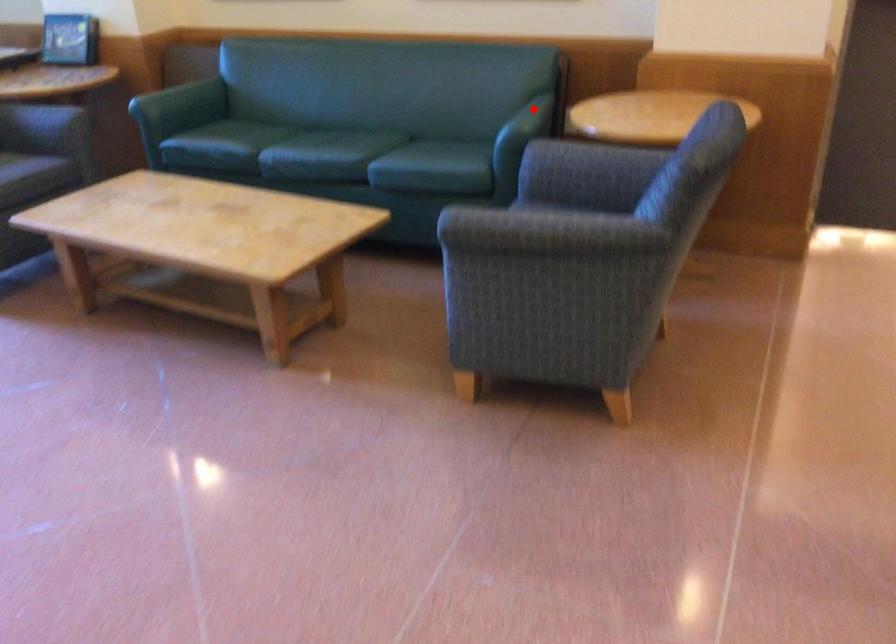
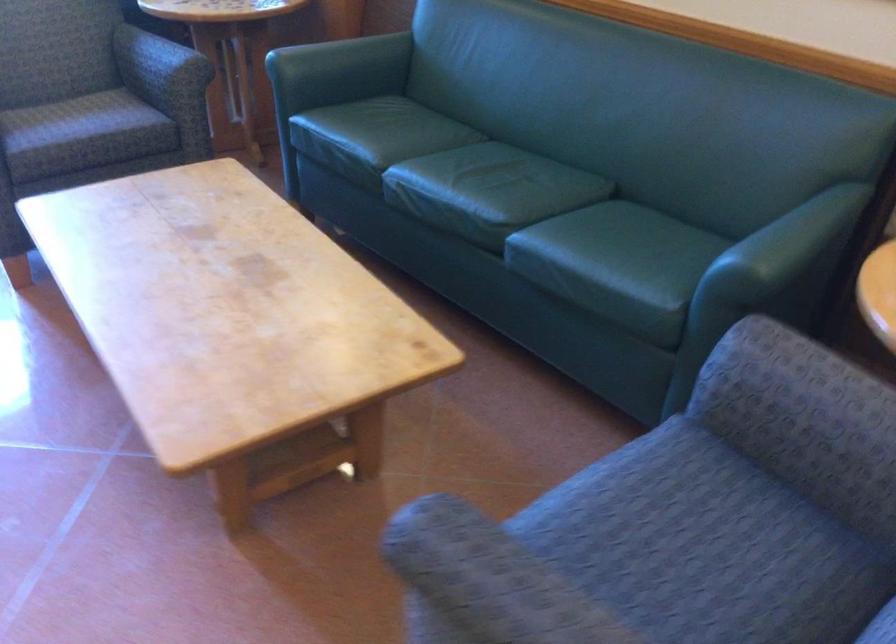
In the second image, find the point that corresponds to the highlighted location in the first image.

(791, 238)